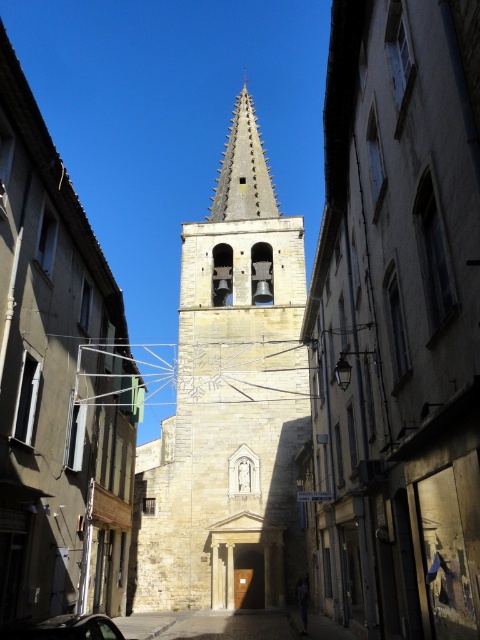
Is point (207, 595) in front of point (16, 627)?

No, it is not.

The height and width of the screenshot is (640, 480). In order to click on stone bell tower at center in this screenshot , I will do `click(229, 403)`.

Which is more to the right, smooth stone spire at center or metallic car at center?

smooth stone spire at center is more to the right.

Does smooth stone spire at center have a greater width compared to metallic car at center?

Yes, smooth stone spire at center is wider than metallic car at center.

Identify the location of smooth stone spire at center. This screenshot has height=640, width=480. (243, 170).

Is point (163, 508) positioned before point (252, 168)?

Yes, point (163, 508) is in front of point (252, 168).

Describe the element at coordinates (229, 403) in the screenshot. Image resolution: width=480 pixels, height=640 pixels. I see `stone bell tower at center` at that location.

Measure the distance between point (243, 362) and camera.

92.70 meters

This screenshot has width=480, height=640. What are the coordinates of `stone bell tower at center` in the screenshot? It's located at (229, 403).